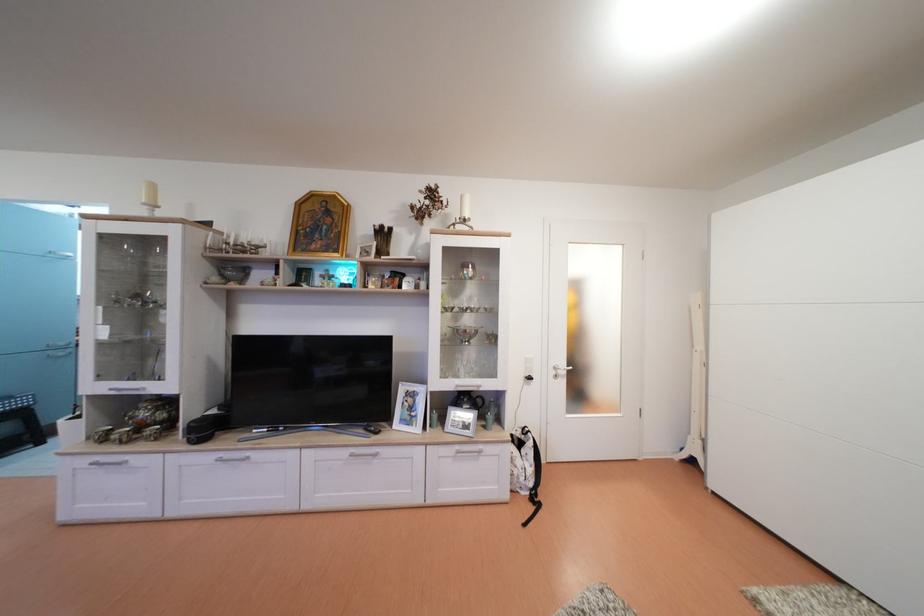
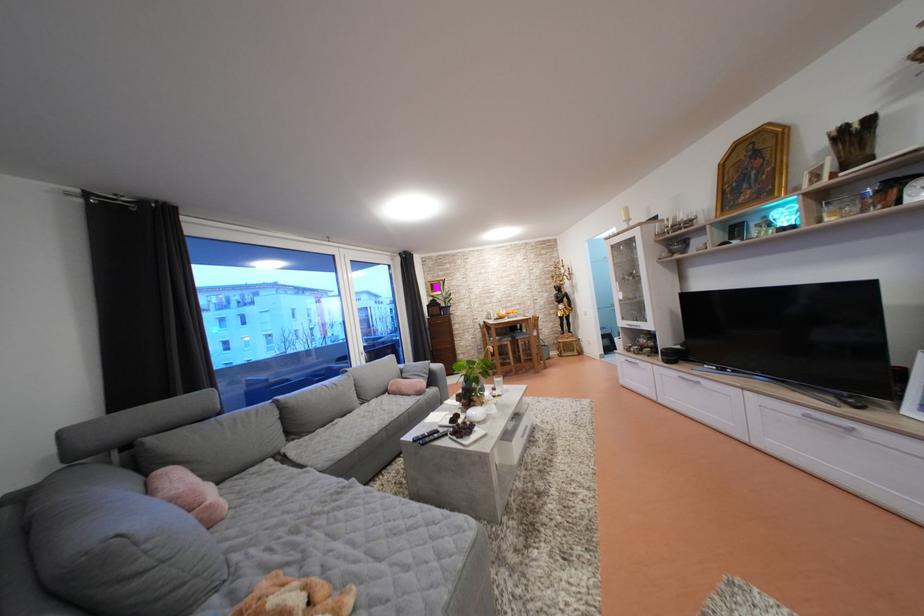
In the second image, find the point that corresponds to point (228, 460) in the first image.

(688, 379)